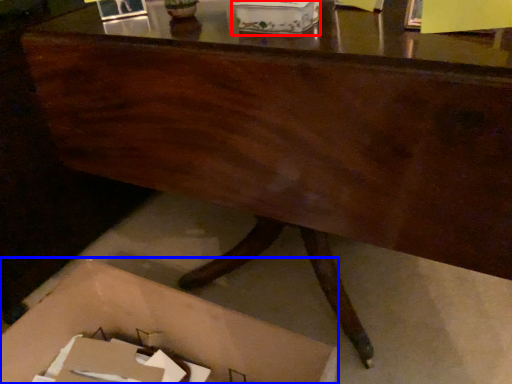
Question: Among these objects, which one is farthest to the camera, storage box (highlighted by a red box) or storage box (highlighted by a blue box)?

Choices:
 (A) storage box
 (B) storage box

Answer: (A)